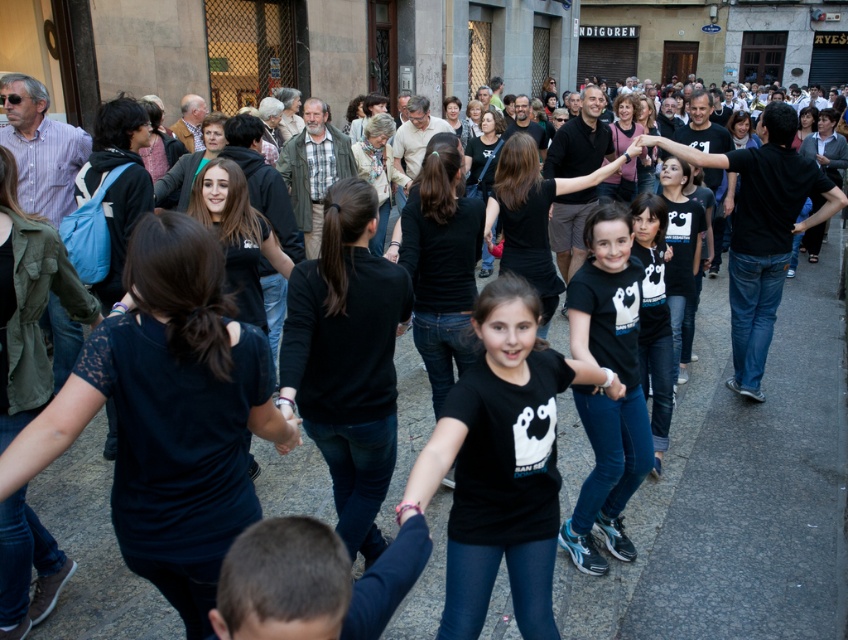
Question: In this image, where is gray concrete pavement at center located relative to black matte shirt at center?

Choices:
 (A) above
 (B) below

Answer: (B)

Question: Does gray concrete pavement at center come behind black matte shirt at center?

Choices:
 (A) yes
 (B) no

Answer: (A)

Question: Is gray concrete pavement at center thinner than black matte shirt at center?

Choices:
 (A) no
 (B) yes

Answer: (B)

Question: Among these points, which one is farthest from the camera?

Choices:
 (A) click(564, 483)
 (B) click(545, 413)

Answer: (A)